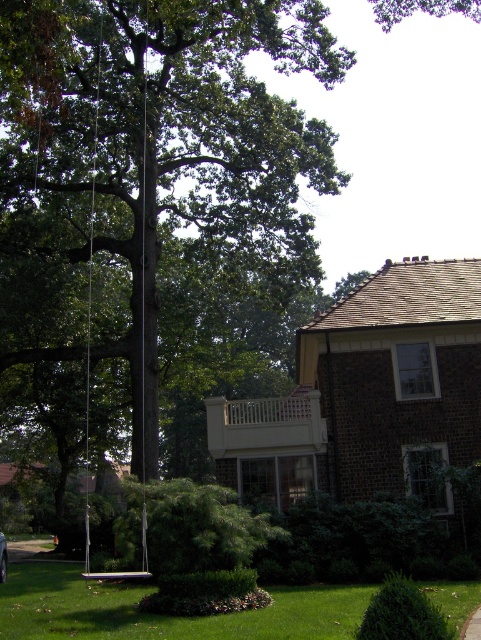
Question: Is green leafy tree at center to the right of metallic silver swing at left from the viewer's perspective?

Choices:
 (A) yes
 (B) no

Answer: (A)

Question: Is green leafy tree at center above metallic silver swing at left?

Choices:
 (A) yes
 (B) no

Answer: (A)

Question: Which object is closer to the camera taking this photo?

Choices:
 (A) metallic silver swing at left
 (B) white fabric string at center
 (C) metallic silver car at lower left

Answer: (A)

Question: Does green leafy tree at center have a larger size compared to metallic silver car at lower left?

Choices:
 (A) yes
 (B) no

Answer: (A)

Question: Which object is positioned closest to the green leafy tree at center?

Choices:
 (A) metallic silver swing at left
 (B) white fabric string at center
 (C) metallic silver car at lower left

Answer: (A)

Question: Estimate the real-world distances between objects in this image. Which object is closer to the green leafy tree at center?

Choices:
 (A) green grass at lower center
 (B) white fabric string at center

Answer: (B)